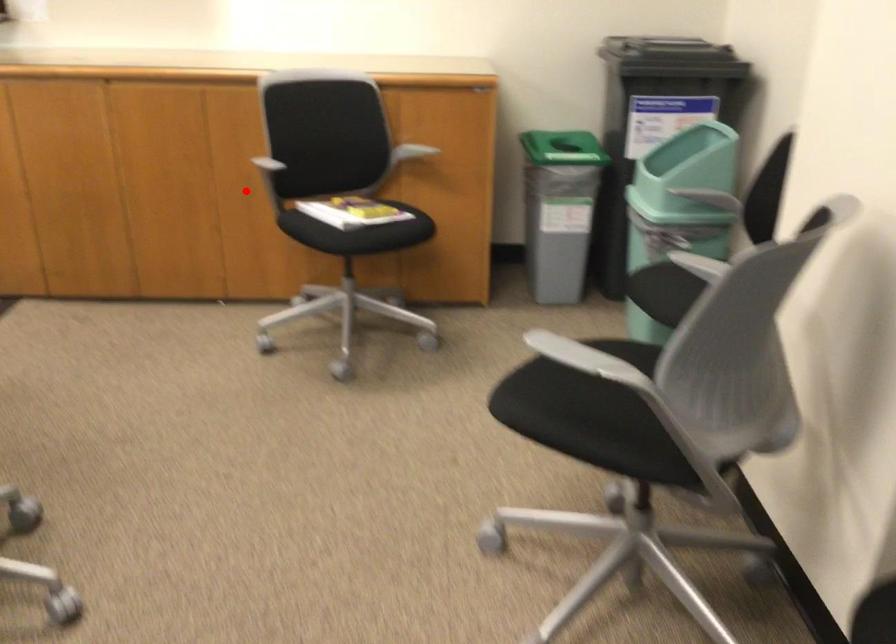
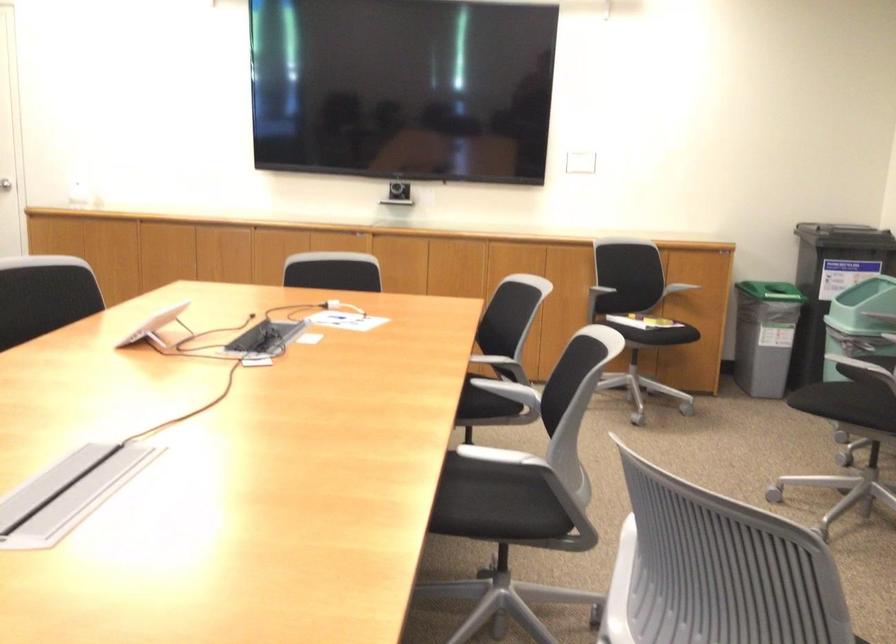
Question: A red point is marked in image1. In image2, is the corresponding 3D point closer to the camera or farther? Reply with the corresponding letter.

Choices:
 (A) The corresponding 3D point is closer.
 (B) The corresponding 3D point is farther.

Answer: (B)